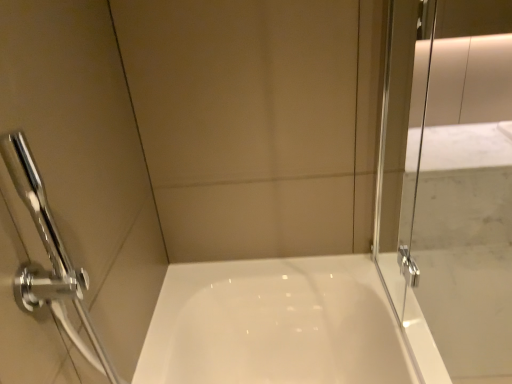
Question: Does chrome metallic showerhead at left appear on the right side of transparent glass screen door at right?

Choices:
 (A) yes
 (B) no

Answer: (B)

Question: Can you confirm if chrome metallic showerhead at left is wider than transparent glass screen door at right?

Choices:
 (A) yes
 (B) no

Answer: (A)

Question: From the image's perspective, does chrome metallic showerhead at left appear lower than transparent glass screen door at right?

Choices:
 (A) no
 (B) yes

Answer: (B)

Question: Is chrome metallic showerhead at left aimed at transparent glass screen door at right?

Choices:
 (A) yes
 (B) no

Answer: (A)

Question: From a real-world perspective, is chrome metallic showerhead at left beneath transparent glass screen door at right?

Choices:
 (A) no
 (B) yes

Answer: (B)

Question: From a real-world perspective, is chrome metallic showerhead at left over transparent glass screen door at right?

Choices:
 (A) no
 (B) yes

Answer: (A)

Question: Is chrome metallic showerhead at left at the back of transparent glass screen door at right?

Choices:
 (A) no
 (B) yes

Answer: (B)

Question: From a real-world perspective, is transparent glass screen door at right physically below chrome metallic showerhead at left?

Choices:
 (A) no
 (B) yes

Answer: (A)

Question: Can you confirm if transparent glass screen door at right is taller than chrome metallic showerhead at left?

Choices:
 (A) no
 (B) yes

Answer: (B)

Question: Can you confirm if transparent glass screen door at right is thinner than chrome metallic showerhead at left?

Choices:
 (A) yes
 (B) no

Answer: (A)

Question: Is transparent glass screen door at right positioned before chrome metallic showerhead at left?

Choices:
 (A) no
 (B) yes

Answer: (B)

Question: Is transparent glass screen door at right bigger than chrome metallic showerhead at left?

Choices:
 (A) yes
 (B) no

Answer: (A)

Question: From the image's perspective, is transparent glass screen door at right above or below chrome metallic showerhead at left?

Choices:
 (A) above
 (B) below

Answer: (A)